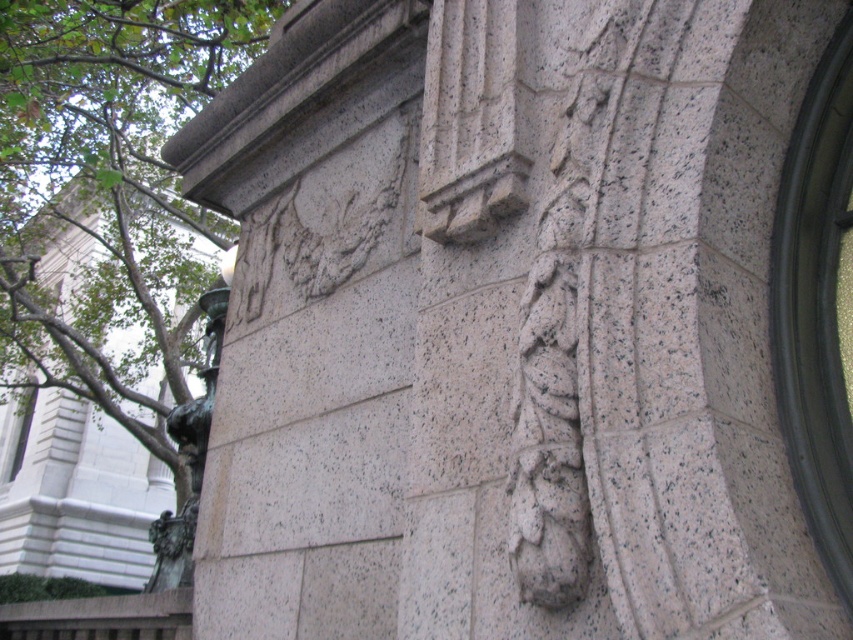
Question: Does granite carving at center-right appear over bronze statue at left?

Choices:
 (A) yes
 (B) no

Answer: (A)

Question: Does granite carving at center-right have a larger size compared to bronze statue at left?

Choices:
 (A) no
 (B) yes

Answer: (A)

Question: Does granite carving at center-right have a greater width compared to bronze statue at left?

Choices:
 (A) yes
 (B) no

Answer: (B)

Question: Which point appears closest to the camera in this image?

Choices:
 (A) (564, 186)
 (B) (219, 308)

Answer: (A)